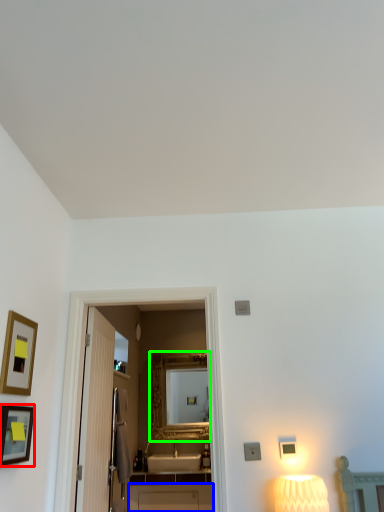
Question: Which is farther away from picture frame (highlighted by a red box)? cabinetry (highlighted by a blue box) or mirror (highlighted by a green box)?

Choices:
 (A) cabinetry
 (B) mirror

Answer: (B)